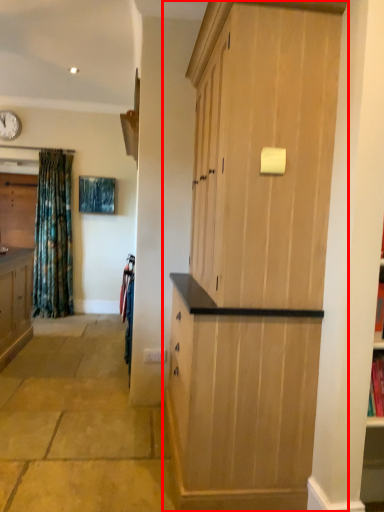
Question: Considering the relative positions of cupboard (annotated by the red box) and clock in the image provided, where is cupboard (annotated by the red box) located with respect to the staircase?

Choices:
 (A) left
 (B) right

Answer: (B)